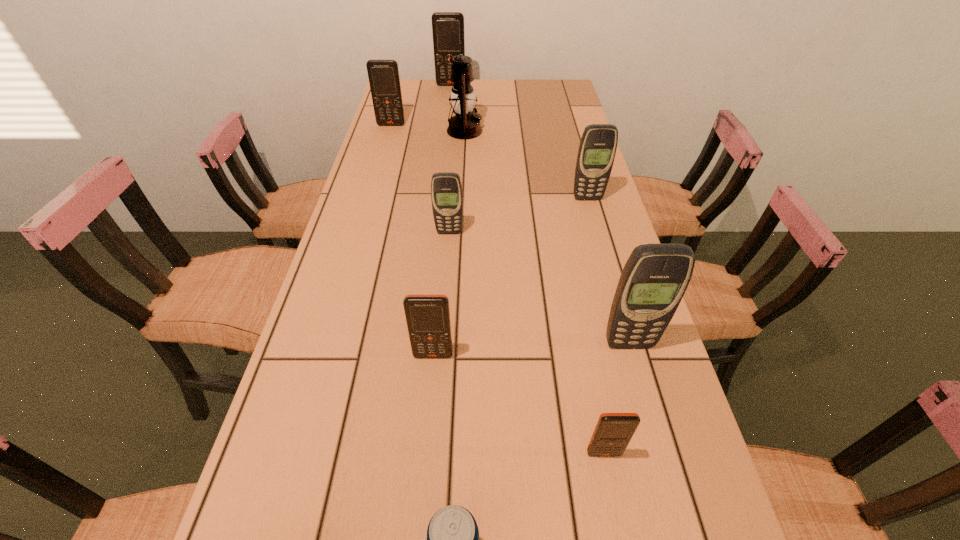
Find the location of a particular element. The height and width of the screenshot is (540, 960). vacant space in between the biggest orange cellular telephone and the biggest gray cellular telephone is located at coordinates (540, 214).

You are a GUI agent. You are given a task and a screenshot of the screen. Output one action in this format:
    pyautogui.click(x=<x>, y=<y>)
    Task: Click on the blank region between the nearest orange cellular telephone and the second nearest gray cellular telephone
    Image resolution: width=960 pixels, height=540 pixels.
    Given the screenshot: What is the action you would take?
    pyautogui.click(x=527, y=343)

Where is `vacant space in between the sixth farthest cellular telephone and the nearest gray cellular telephone`? Image resolution: width=960 pixels, height=540 pixels. vacant space in between the sixth farthest cellular telephone and the nearest gray cellular telephone is located at coordinates (531, 349).

Identify the location of vacant point located between the seventh object from left to right and the farthest orange cellular telephone. (527, 269).

Find the location of a particular element. The width and height of the screenshot is (960, 540). object that is the fourth closest to the leftmost cellular telephone is located at coordinates (598, 145).

Find the location of a particular element. The height and width of the screenshot is (540, 960). object that is the fifth closest one to the blue pop is located at coordinates (598, 145).

This screenshot has height=540, width=960. Find the location of `cellular telephone that is the second closest to the sixth farthest object`. cellular telephone that is the second closest to the sixth farthest object is located at coordinates (428, 316).

The image size is (960, 540). In order to click on the fourth closest cellular telephone relative to the lantern in this screenshot , I will do `click(446, 189)`.

Find the location of `orange cellular telephone that is the closest one to the biggest orange cellular telephone`. orange cellular telephone that is the closest one to the biggest orange cellular telephone is located at coordinates (383, 75).

I want to click on the third closest orange cellular telephone to the second farthest gray cellular telephone, so click(x=613, y=432).